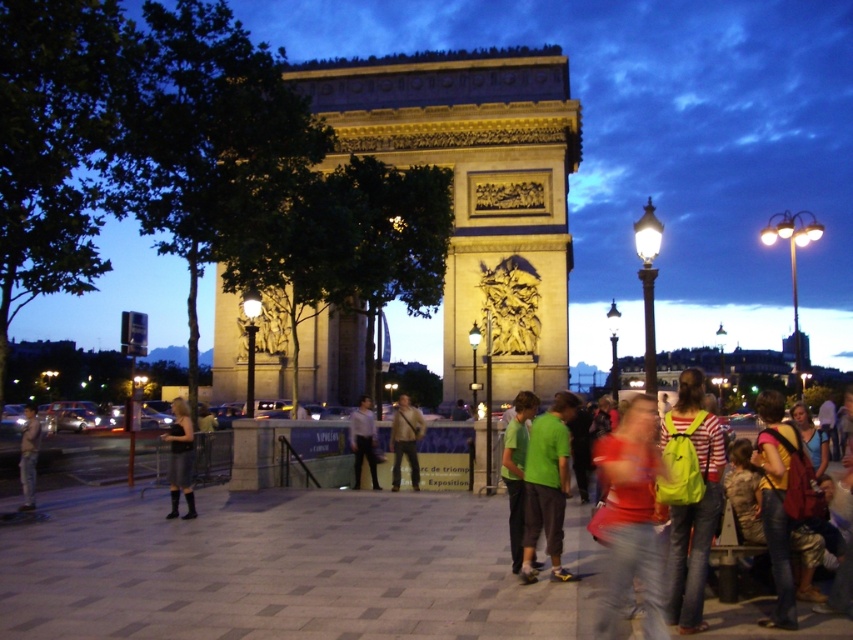
Question: Considering the relative positions of green backpack at center and light blue shirt at center in the image provided, where is green backpack at center located with respect to light blue shirt at center?

Choices:
 (A) above
 (B) below

Answer: (B)

Question: Based on their relative distances, which object is nearer to the yellow backpack at lower right?

Choices:
 (A) matte brown bag at center
 (B) light blue shirt at center

Answer: (A)

Question: Can you confirm if golden stone arch at center is thinner than light blue shirt at center?

Choices:
 (A) no
 (B) yes

Answer: (A)

Question: Among these points, which one is farthest from the camera?

Choices:
 (A) (796, 445)
 (B) (218, 273)

Answer: (B)

Question: Which point is closer to the camera taking this photo?

Choices:
 (A) (183, 404)
 (B) (498, 321)

Answer: (B)

Question: Can you confirm if green backpack at center is positioned to the left of yellow backpack at lower right?

Choices:
 (A) yes
 (B) no

Answer: (A)